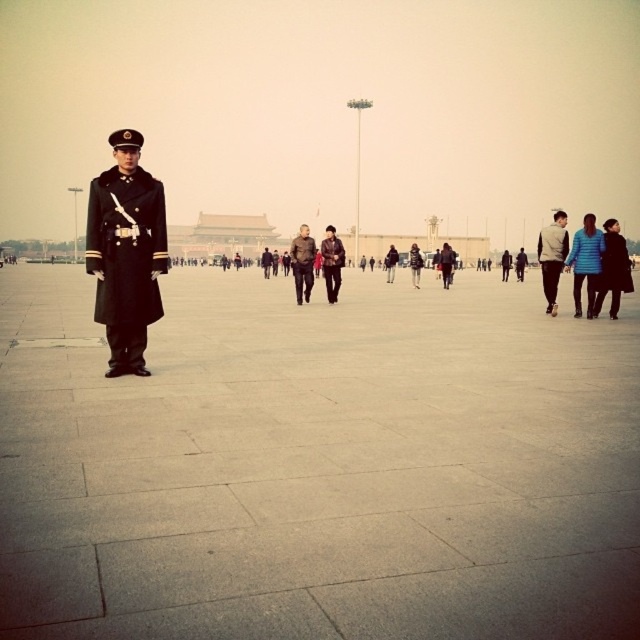
Who is lower down, black woolen coat at center or blue matte jacket at right?

black woolen coat at center is below.

Who is more forward, (129,216) or (592,241)?

Point (129,216) is in front.

Locate an element on the screen. black woolen coat at center is located at coordinates (125, 260).

Identify the location of brown leather jacket at center. (301, 262).

Who is more distant from viewer, (305,275) or (342,259)?

Point (342,259)

Does point (305, 243) come behind point (332, 237)?

No, (305, 243) is in front of (332, 237).

Locate an element on the screen. This screenshot has height=640, width=640. brown leather jacket at center is located at coordinates (301, 262).

Who is taller, black woolen coat at center or brown leather jacket at center?

brown leather jacket at center

Does black woolen coat at center appear on the left side of brown leather jacket at center?

Correct, you'll find black woolen coat at center to the left of brown leather jacket at center.

Which is in front, point (106, 316) or point (289, 253)?

Point (106, 316)

This screenshot has width=640, height=640. What are the coordinates of `black woolen coat at center` in the screenshot? It's located at (125, 260).